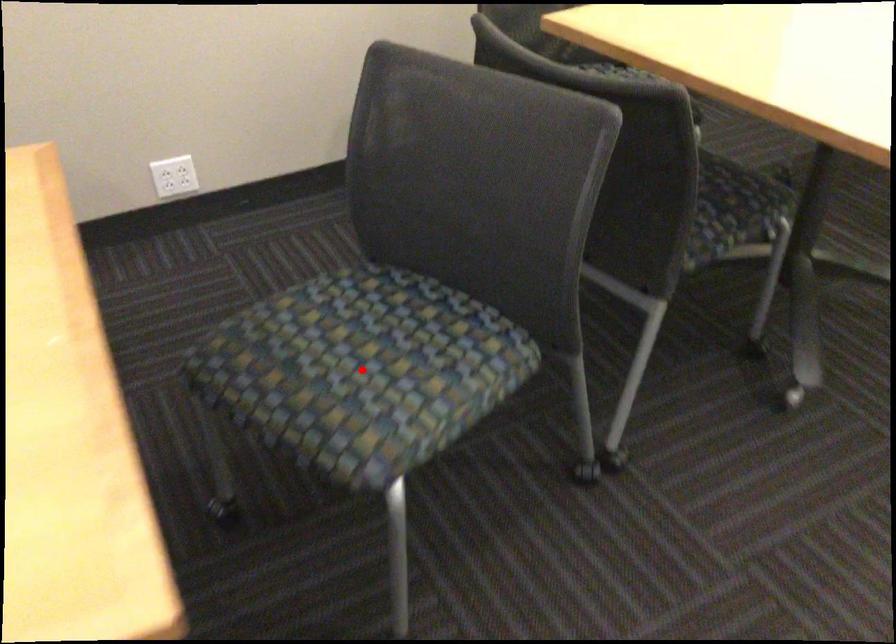
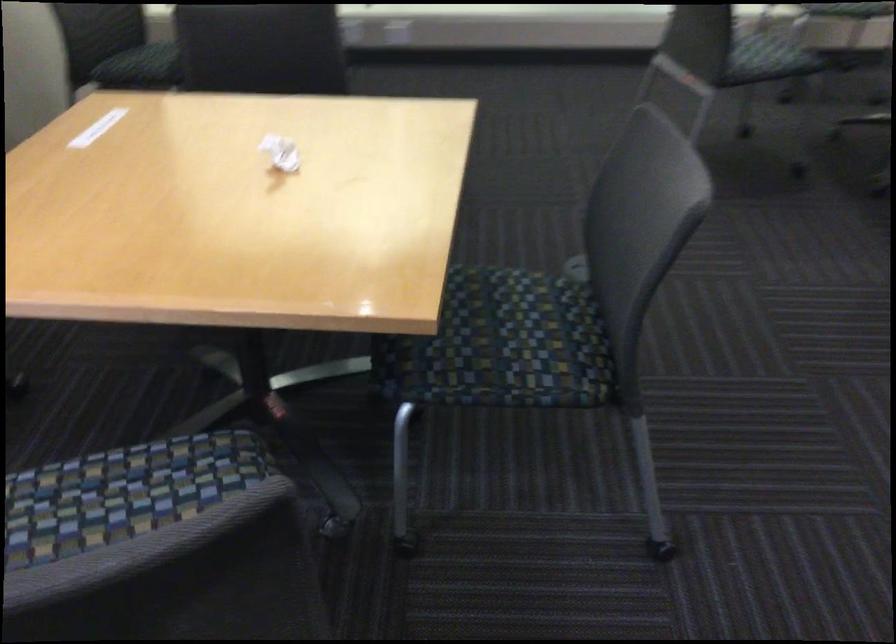
Question: I am providing you with two images of the same scene from different viewpoints. A red point is marked on the first image. At the location where the point appears in image 1, is it still visible in image 2?

Choices:
 (A) Yes
 (B) No

Answer: (B)